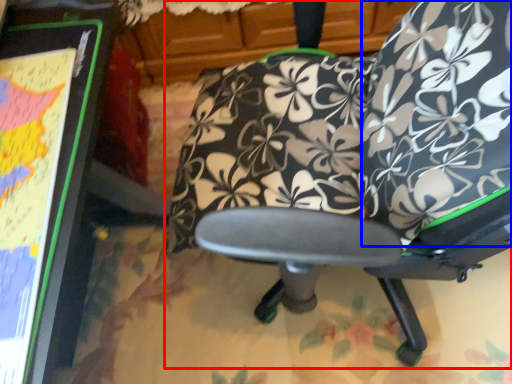
Question: Which object is further to the camera taking this photo, chair (highlighted by a red box) or bean bag chair (highlighted by a blue box)?

Choices:
 (A) chair
 (B) bean bag chair

Answer: (B)